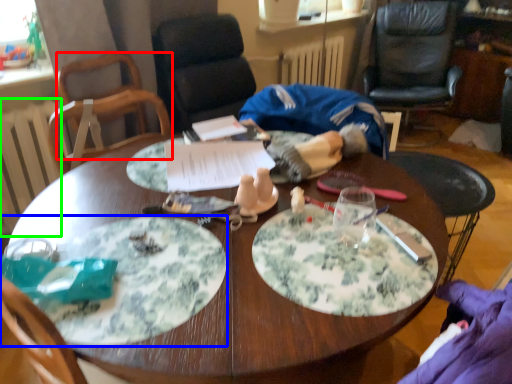
Question: Considering the real-world distances, which object is closest to chair (highlighted by a red box)? plate (highlighted by a blue box) or radiator (highlighted by a green box).

Choices:
 (A) plate
 (B) radiator

Answer: (B)